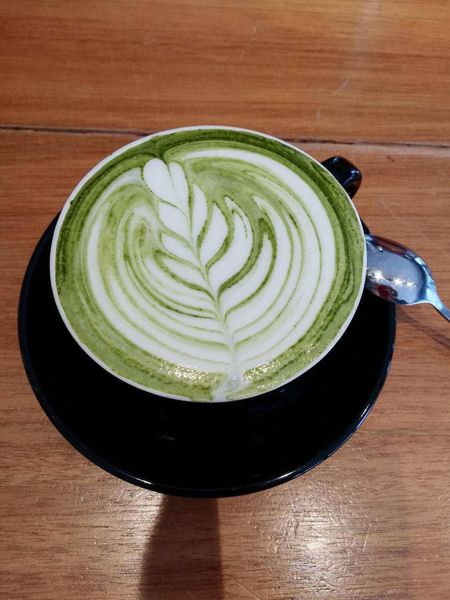
I want to click on gap between wooden boards on wood-grain surface, so click(22, 127), click(102, 131), click(335, 141), click(424, 144).